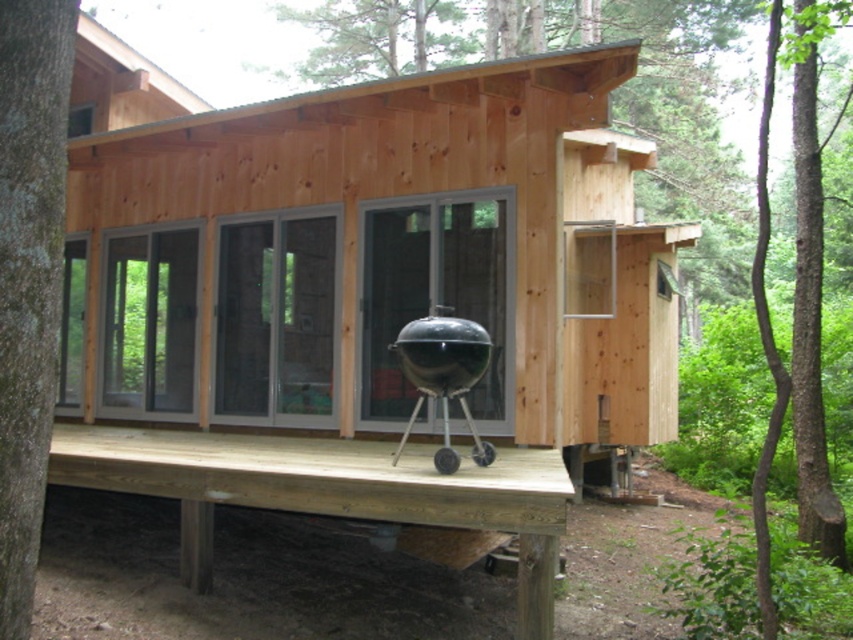
Which of these two, brown rough bark tree at left or black matte barbecue grill at center, stands taller?

Standing taller between the two is brown rough bark tree at left.

Is brown rough bark tree at left to the left of black matte barbecue grill at center from the viewer's perspective?

Indeed, brown rough bark tree at left is positioned on the left side of black matte barbecue grill at center.

Does point (38, 268) come behind point (440, 362)?

That is False.

This screenshot has height=640, width=853. Find the location of `brown rough bark tree at left`. brown rough bark tree at left is located at coordinates (28, 276).

Does natural wood cabin at center appear over black matte barbecue grill at center?

Yes, natural wood cabin at center is above black matte barbecue grill at center.

Does natural wood cabin at center have a smaller size compared to black matte barbecue grill at center?

Incorrect, natural wood cabin at center is not smaller in size than black matte barbecue grill at center.

Between point (288, 365) and point (476, 436), which one is positioned in front?

Point (476, 436) is more forward.

Locate an element on the screen. Image resolution: width=853 pixels, height=640 pixels. natural wood cabin at center is located at coordinates (378, 257).

Does natural wood deck at center have a smaller size compared to brown rough bark tree at left?

Incorrect, natural wood deck at center is not smaller in size than brown rough bark tree at left.

What do you see at coordinates (328, 490) in the screenshot? The width and height of the screenshot is (853, 640). I see `natural wood deck at center` at bounding box center [328, 490].

Find the location of a particular element. The height and width of the screenshot is (640, 853). natural wood deck at center is located at coordinates (328, 490).